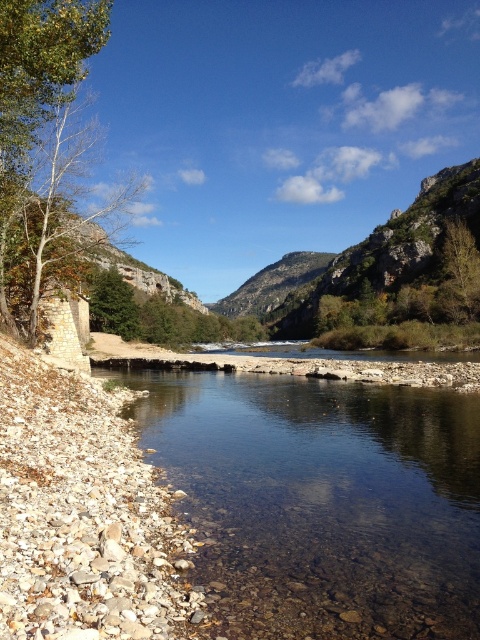
What do you see at coordinates (324, 500) in the screenshot? I see `clear water at center` at bounding box center [324, 500].

Who is more forward, (322, 385) or (374, 264)?

Positioned in front is point (322, 385).

Is point (342, 456) farther from viewer compared to point (466, 211)?

That is False.

Find the location of a particular element. This screenshot has height=640, width=480. clear water at center is located at coordinates (324, 500).